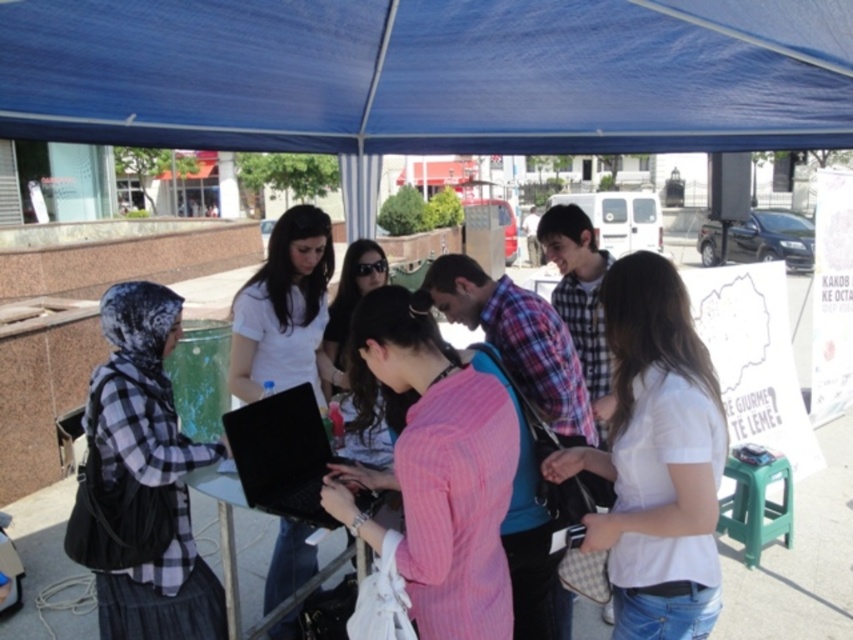
Question: Can you confirm if white matte shirt at center is positioned to the right of black matte laptop at center?

Choices:
 (A) no
 (B) yes

Answer: (B)

Question: Among these objects, which one is farthest from the camera?

Choices:
 (A) white matte shirt at center
 (B) pink striped shirt at center
 (C) plaid fabric shirt at left
 (D) metallic silver table at center

Answer: (C)

Question: Which object appears closest to the camera in this image?

Choices:
 (A) blue fabric canopy at upper center
 (B) pink striped shirt at center

Answer: (B)

Question: Which object is the closest to the pink striped shirt at center?

Choices:
 (A) black matte laptop at center
 (B) green plastic stool at lower right

Answer: (A)

Question: Does blue fabric canopy at upper center appear on the left side of metallic silver table at center?

Choices:
 (A) yes
 (B) no

Answer: (B)

Question: Does plaid fabric shirt at left have a lesser width compared to metallic silver table at center?

Choices:
 (A) yes
 (B) no

Answer: (B)